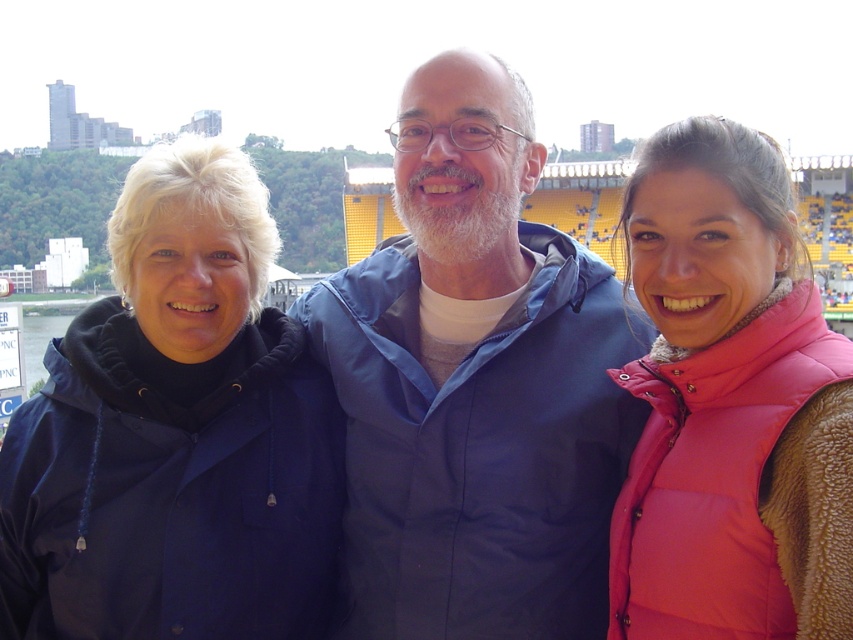
You are a photographer trying to capture a group photo of the blue fabric jacket at center and the navy blue jacket at left. If you want to ensure both jackets are fully visible in the frame, which jacket requires more space horizontally?

The blue fabric jacket at center requires more horizontal space because its width is larger than the navy blue jacket at left.

You are at a stadium and see two jackets. The blue fabric jacket at center and the navy blue jacket at left. Which one is positioned to the right of the other?

The blue fabric jacket at center is positioned to the right of the navy blue jacket at left.